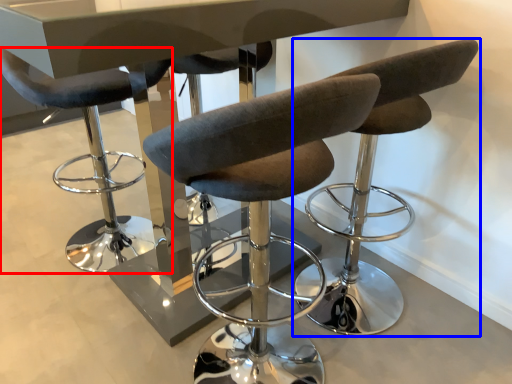
Question: Which point is further to the camera, chair (highlighted by a red box) or chair (highlighted by a blue box)?

Choices:
 (A) chair
 (B) chair

Answer: (A)